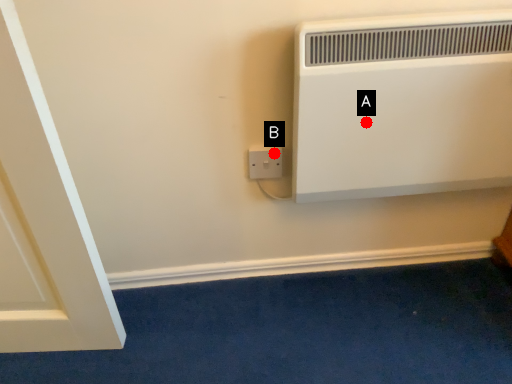
Question: Two points are circled on the image, labeled by A and B beside each circle. Which point is further to the camera?

Choices:
 (A) A is further
 (B) B is further

Answer: (B)